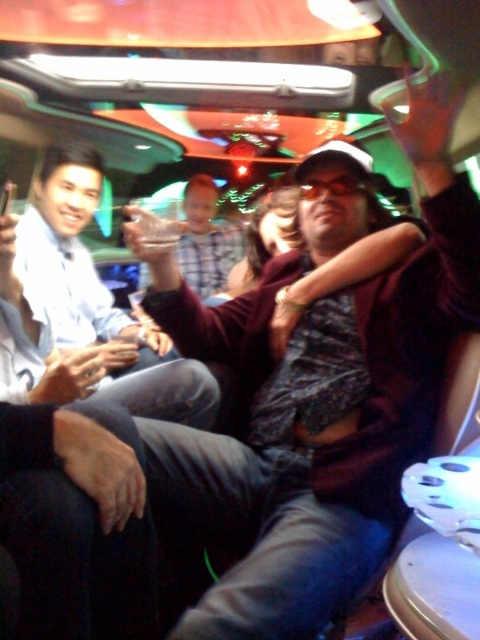
Question: Which point is closer to the camera?

Choices:
 (A) plaid shirt at center
 (B) matte white shirt at left

Answer: (B)

Question: Observing the image, what is the correct spatial positioning of matte white shirt at left in reference to plaid shirt at center?

Choices:
 (A) left
 (B) right

Answer: (A)

Question: Which point is closer to the camera taking this photo?

Choices:
 (A) (57, 378)
 (B) (218, 262)

Answer: (A)

Question: Is matte white shirt at left above plaid shirt at center?

Choices:
 (A) no
 (B) yes

Answer: (A)

Question: Among these points, which one is nearest to the camera?

Choices:
 (A) (76, 275)
 (B) (180, 262)

Answer: (A)

Question: Can you confirm if matte white shirt at left is bigger than plaid shirt at center?

Choices:
 (A) yes
 (B) no

Answer: (B)